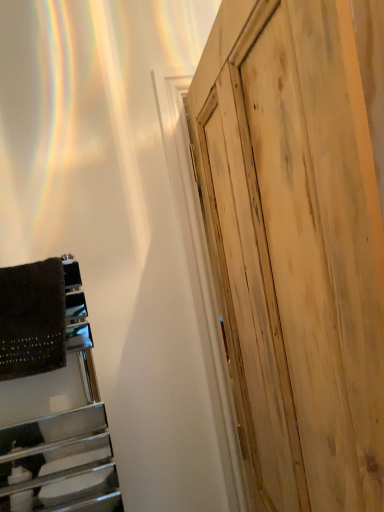
What are the coordinates of `dark brown textured blanket at left` in the screenshot? It's located at click(32, 319).

What do you see at coordinates (32, 319) in the screenshot?
I see `dark brown textured blanket at left` at bounding box center [32, 319].

Measure the distance between point (1, 291) and camera.

They are 37.95 inches apart.

In order to click on natural wood door at right in this screenshot , I will do `click(295, 249)`.

This screenshot has width=384, height=512. What do you see at coordinates (295, 249) in the screenshot?
I see `natural wood door at right` at bounding box center [295, 249].

Image resolution: width=384 pixels, height=512 pixels. What are the coordinates of `dark brown textured blanket at left` in the screenshot? It's located at (32, 319).

Consider the image. Considering the relative positions of dark brown textured blanket at left and natural wood door at right in the image provided, is dark brown textured blanket at left to the left of natural wood door at right from the viewer's perspective?

Correct, you'll find dark brown textured blanket at left to the left of natural wood door at right.

Consider the image. Is dark brown textured blanket at left behind natural wood door at right?

Yes, it is.

Which is nearer, [36,351] or [223,279]?

Point [36,351]

From the image's perspective, who appears lower, dark brown textured blanket at left or natural wood door at right?

natural wood door at right.

From a real-world perspective, between dark brown textured blanket at left and natural wood door at right, who is vertically higher?

In real-world perspective, dark brown textured blanket at left is above.

Considering the sizes of objects dark brown textured blanket at left and natural wood door at right in the image provided, who is thinner, dark brown textured blanket at left or natural wood door at right?

dark brown textured blanket at left is thinner.

Who is shorter, dark brown textured blanket at left or natural wood door at right?

dark brown textured blanket at left is shorter.

Who is smaller, dark brown textured blanket at left or natural wood door at right?

dark brown textured blanket at left is smaller.

Is dark brown textured blanket at left inside or outside of natural wood door at right?

dark brown textured blanket at left exists outside the volume of natural wood door at right.

From the picture: Would you say dark brown textured blanket at left is a long distance from natural wood door at right?

No, there isn't a large distance between dark brown textured blanket at left and natural wood door at right.

Looking at this image, is dark brown textured blanket at left oriented away from natural wood door at right?

That's not correct — dark brown textured blanket at left is not looking away from natural wood door at right.

How many degrees apart are the facing directions of dark brown textured blanket at left and natural wood door at right?

They differ by 7.33 degrees in their facing directions.

How much distance is there between dark brown textured blanket at left and natural wood door at right?

22.99 inches.

Where is `blanket that appears behind the natural wood door at right`? blanket that appears behind the natural wood door at right is located at coordinates (32, 319).

Visually, is natural wood door at right positioned to the left or to the right of dark brown textured blanket at left?

natural wood door at right is positioned on dark brown textured blanket at left's right side.

Does natural wood door at right lie behind dark brown textured blanket at left?

No, natural wood door at right is closer to the camera.

Which is more distant, (315, 417) or (61, 330)?

The point (61, 330) is more distant.

From the image's perspective, is natural wood door at right located above or below dark brown textured blanket at left?

natural wood door at right is situated lower than dark brown textured blanket at left in the image.

From a real-world perspective, between natural wood door at right and dark brown textured blanket at left, who is vertically lower?

natural wood door at right.

Which of these two, natural wood door at right or dark brown textured blanket at left, is thinner?

Thinner between the two is dark brown textured blanket at left.

Is natural wood door at right taller than dark brown textured blanket at left?

Yes.

Is natural wood door at right smaller than dark brown textured blanket at left?

Incorrect, natural wood door at right is not smaller in size than dark brown textured blanket at left.

In the scene shown: Does natural wood door at right contain dark brown textured blanket at left?

Actually, dark brown textured blanket at left is outside natural wood door at right.

Is natural wood door at right beside dark brown textured blanket at left?

natural wood door at right is not next to dark brown textured blanket at left, and they're not touching.

Is natural wood door at right oriented away from dark brown textured blanket at left?

That's not correct — natural wood door at right is not looking away from dark brown textured blanket at left.

Measure the distance between natural wood door at right and dark brown textured blanket at left.

They are 22.99 inches apart.

This screenshot has width=384, height=512. What are the coordinates of `door to the right of dark brown textured blanket at left` in the screenshot? It's located at (295, 249).

Find the location of a particular element. The image size is (384, 512). door that is below the dark brown textured blanket at left (from the image's perspective) is located at coordinates (295, 249).

In the image, there is a dark brown textured blanket at left. At what (x,y) coordinates should I click in order to perform the action: click on door below it (from a real-world perspective). Please return your answer as a coordinate pair (x, y). Looking at the image, I should click on (295, 249).